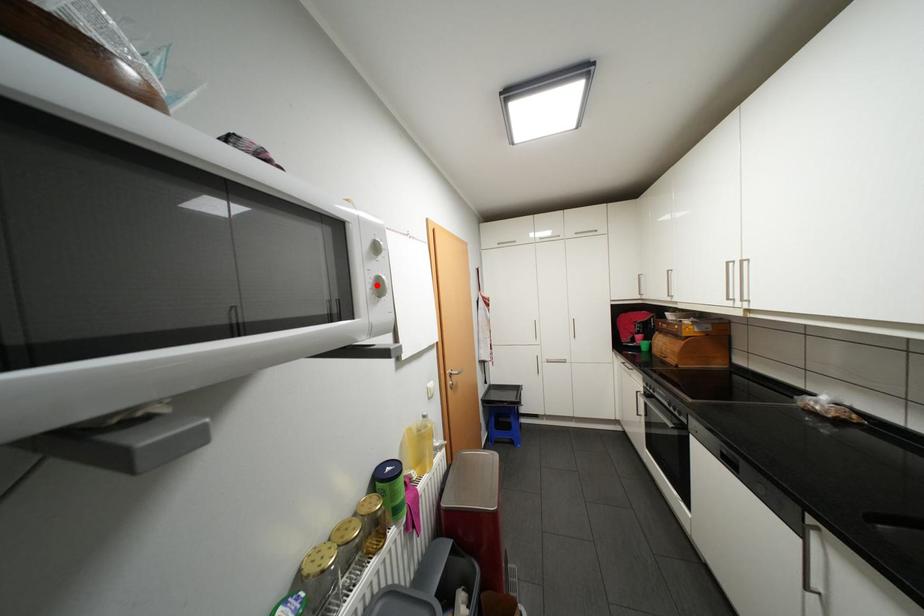
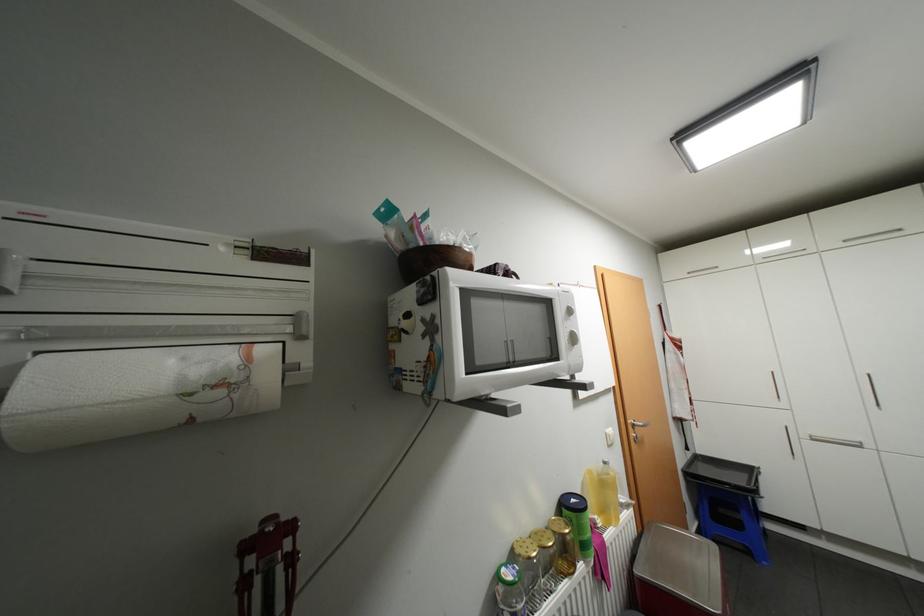
Find the pixel in the second image that matches the highlighted location in the first image.

(575, 337)